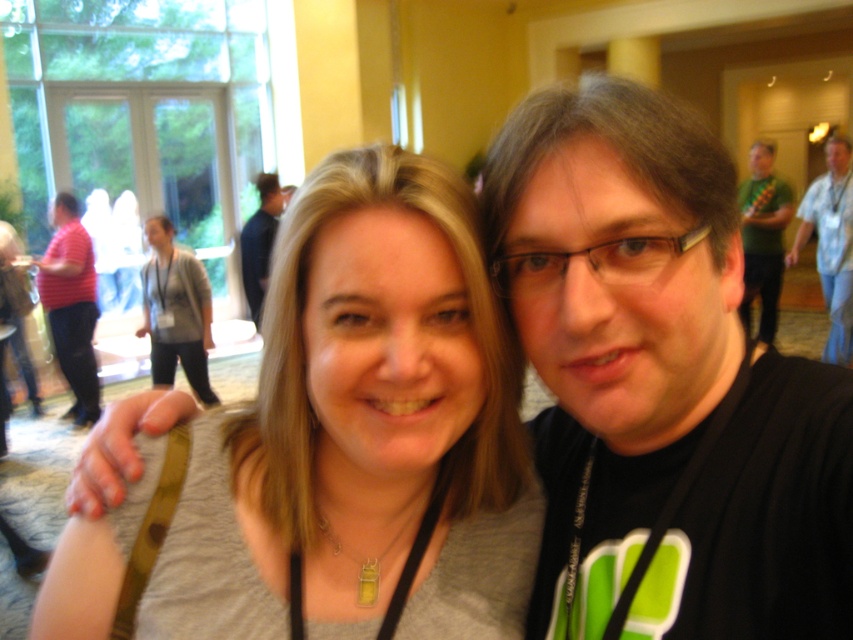
From the picture: You are taking a photo of two people in a room with warm yellow walls. You notice two points marked in the image. The first point is at coordinates point (844, 321) and the second point is at point (282, 196). Which point is nearer to the camera?

Point (844, 321) is closer to the camera than point (282, 196).

You are at a social event and need to locate someone wearing a matte red shirt at left and another wearing a blue striped shirt at upper right. Based on the scene description, which direction should you look to find the person in the blue striped shirt relative to the person in the matte red shirt?

The blue striped shirt at upper right is located to the right of the matte red shirt at left, so you should look to the right of the matte red shirt at left to find the blue striped shirt at upper right.

You are at a social event and want to greet the person wearing the blue striped shirt at upper right. Which direction should you move relative to the matte red shirt at left?

You should move towards the upper right direction away from the matte red shirt at left to reach the blue striped shirt at upper right, since the matte red shirt at left is in front of it.